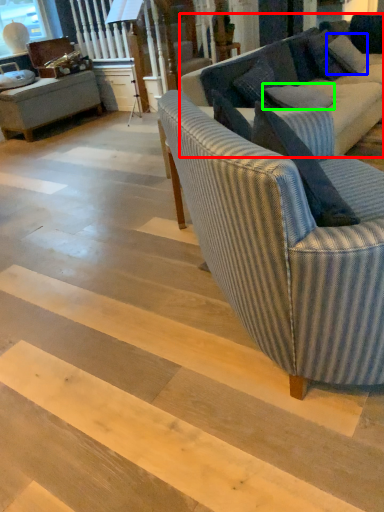
Question: Which is nearer to the studio couch (highlighted by a red box)? pillow (highlighted by a blue box) or pillow (highlighted by a green box).

Choices:
 (A) pillow
 (B) pillow

Answer: (B)